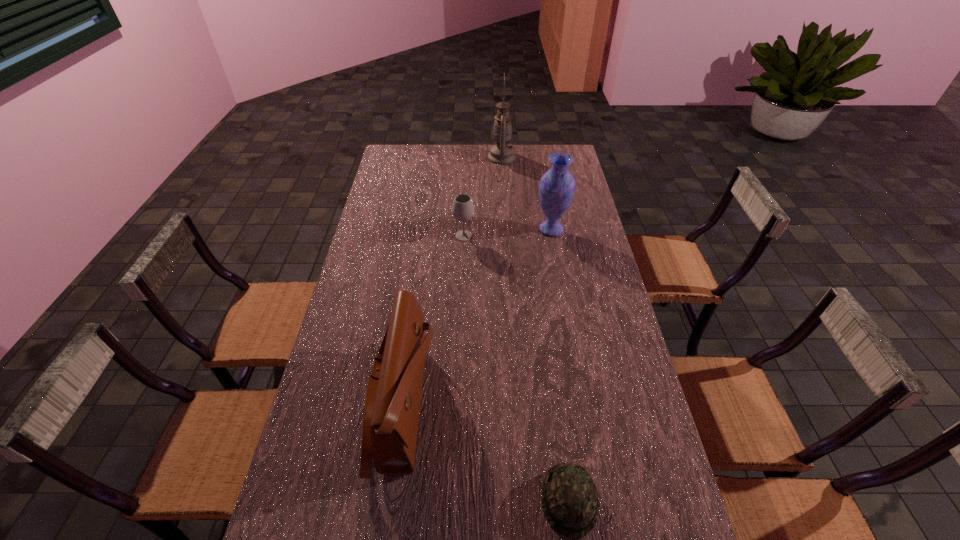
You are a GUI agent. You are given a task and a screenshot of the screen. Output one action in this format:
    pyautogui.click(x=<x>, y=<y>)
    Task: Click on the free spot located 0.290m on the right of the fourth object from right to left
    The width and height of the screenshot is (960, 540).
    Given the screenshot: What is the action you would take?
    pyautogui.click(x=550, y=236)

The height and width of the screenshot is (540, 960). I want to click on free location located on the left of the shortest object, so click(x=455, y=500).

Where is `object at the far edge`? This screenshot has height=540, width=960. object at the far edge is located at coordinates (501, 153).

Identify the location of object present at the left edge. tap(392, 405).

At what (x,y) coordinates should I click in order to perform the action: click on object positioned at the right edge. Please return your answer as a coordinate pair (x, y). This screenshot has width=960, height=540. Looking at the image, I should click on (557, 186).

In the image, there is a desktop. Find the location of `vacant space at the far edge`. vacant space at the far edge is located at coordinates (479, 167).

Find the location of `vacant space at the left edge of the desktop`. vacant space at the left edge of the desktop is located at coordinates (360, 274).

The image size is (960, 540). Identify the location of vacant space at the right edge of the desktop. (643, 483).

At what (x,y) coordinates should I click in order to perform the action: click on vacant space at the far left corner of the desktop. Please return your answer as a coordinate pair (x, y). Image resolution: width=960 pixels, height=540 pixels. Looking at the image, I should click on (395, 158).

This screenshot has height=540, width=960. Find the location of `vacant space at the far right corner`. vacant space at the far right corner is located at coordinates (540, 146).